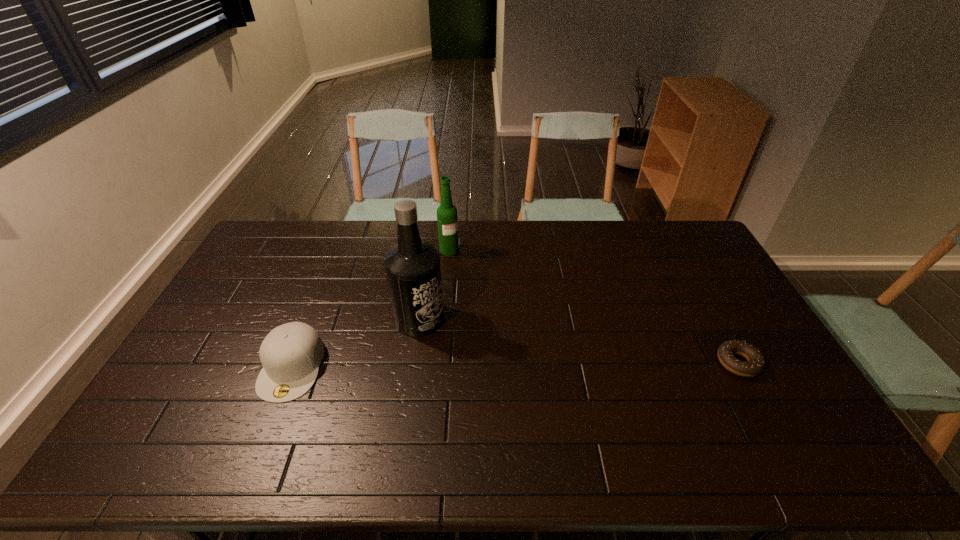
Where is `vacant space located on the front label of the liquor`? Image resolution: width=960 pixels, height=540 pixels. vacant space located on the front label of the liquor is located at coordinates (500, 355).

What are the coordinates of `free point located on the front label of the liquor` in the screenshot? It's located at (516, 362).

I want to click on blank area located on the label of the farthest object, so click(x=512, y=316).

Image resolution: width=960 pixels, height=540 pixels. Find the location of `vacant area situated 0.070m on the label of the farthest object`. vacant area situated 0.070m on the label of the farthest object is located at coordinates (464, 265).

Find the location of a particular element. This screenshot has width=960, height=540. vacant position located on the label of the farthest object is located at coordinates (512, 316).

You are a GUI agent. You are given a task and a screenshot of the screen. Output one action in this format:
    pyautogui.click(x=<x>, y=<y>)
    Task: Click on the object that is at the far edge
    The image size is (960, 540).
    Given the screenshot: What is the action you would take?
    pyautogui.click(x=447, y=221)

The image size is (960, 540). I want to click on object located at the near edge, so click(x=291, y=354).

Where is `object present at the right edge`? Image resolution: width=960 pixels, height=540 pixels. object present at the right edge is located at coordinates (756, 363).

This screenshot has height=540, width=960. I want to click on vacant space at the far edge of the desktop, so click(389, 248).

Where is `blank area at the near edge`? blank area at the near edge is located at coordinates (618, 405).